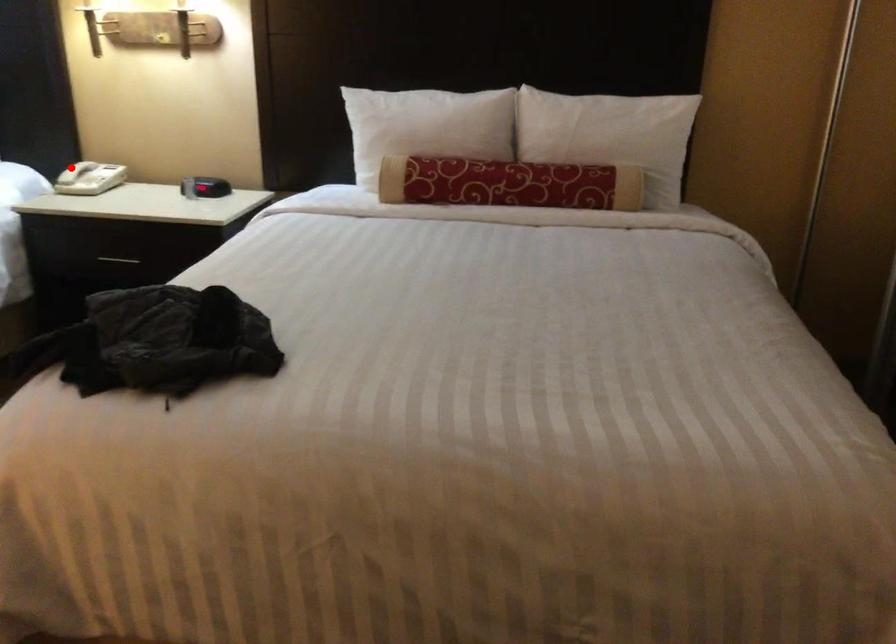
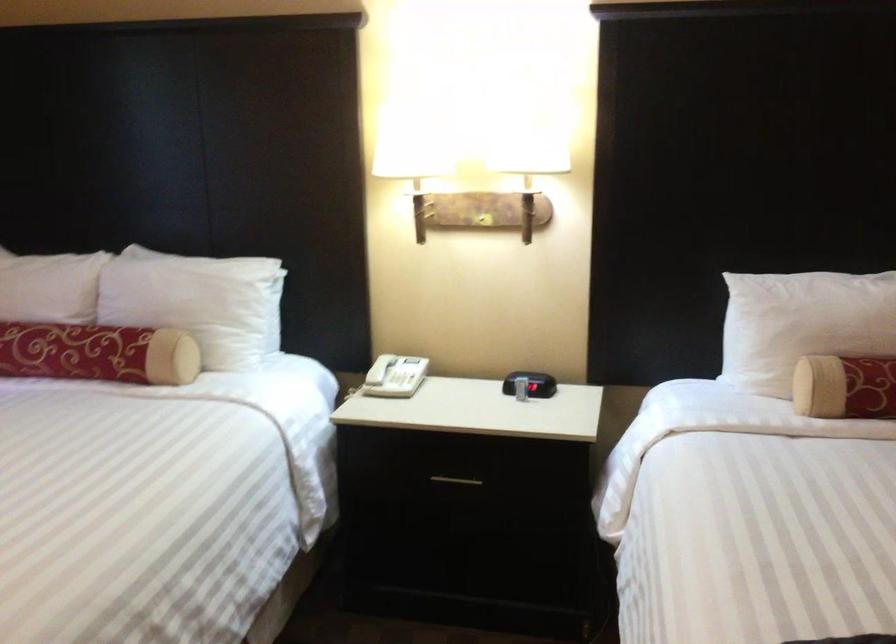
Where in the second image is the point corresponding to the highlighted location from the first image?

(380, 368)